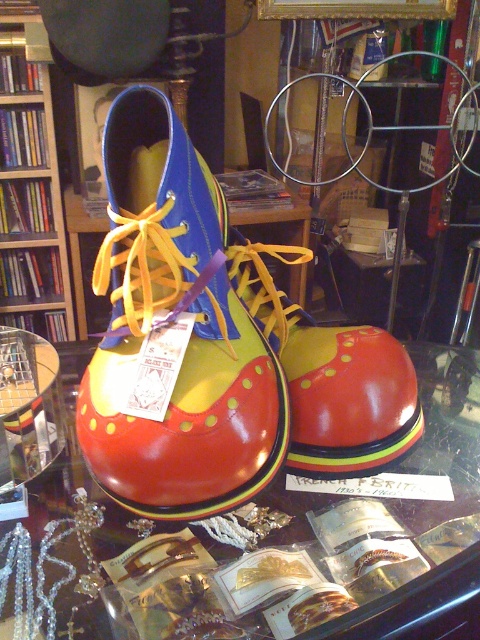
Is glossy leather clown shoe at center further to camera compared to glossy clown shoe at center?

No, glossy leather clown shoe at center is in front of glossy clown shoe at center.

Image resolution: width=480 pixels, height=640 pixels. In order to click on glossy leather clown shoe at center in this screenshot , I will do `click(189, 340)`.

Identify the location of transparent glass table at center. Image resolution: width=480 pixels, height=640 pixels. (265, 545).

Is point (429, 422) positioned behind point (166, 148)?

Yes, it is behind point (166, 148).

The width and height of the screenshot is (480, 640). I want to click on transparent glass table at center, so click(x=265, y=545).

This screenshot has width=480, height=640. Identify the location of transparent glass table at center. (265, 545).

Between glossy leather clown shoe at center and wooden bookshelf at left, which one is positioned lower?

glossy leather clown shoe at center

Is glossy leather clown shoe at center smaller than wooden bookshelf at left?

Correct, glossy leather clown shoe at center occupies less space than wooden bookshelf at left.

Where is `glossy leather clown shoe at center`? This screenshot has width=480, height=640. glossy leather clown shoe at center is located at coordinates (189, 340).